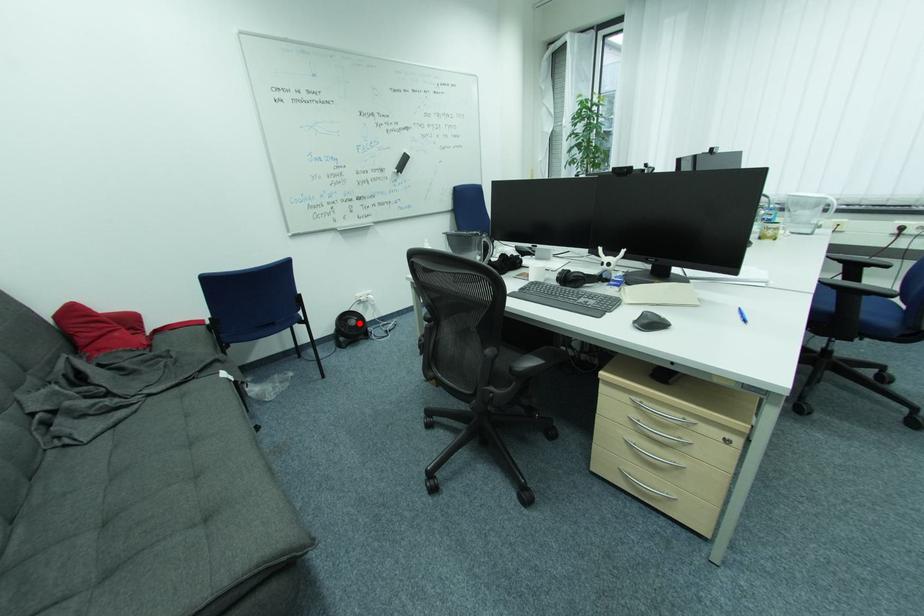
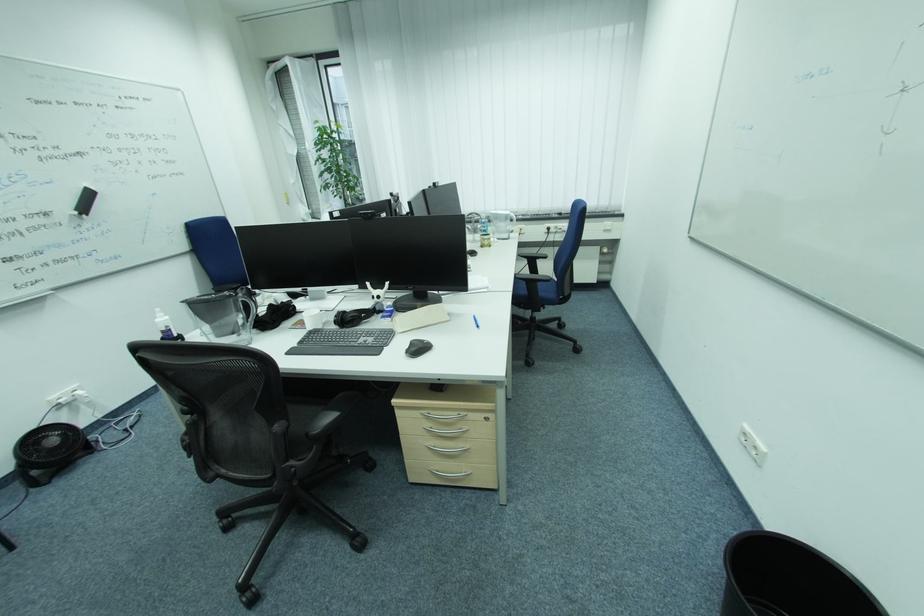
Question: I am providing you with two images of the same scene from different viewpoints. A red point is shown in image1. For the corresponding object point in image2, is it positioned nearer or farther from the camera?

Choices:
 (A) Nearer
 (B) Farther

Answer: (B)